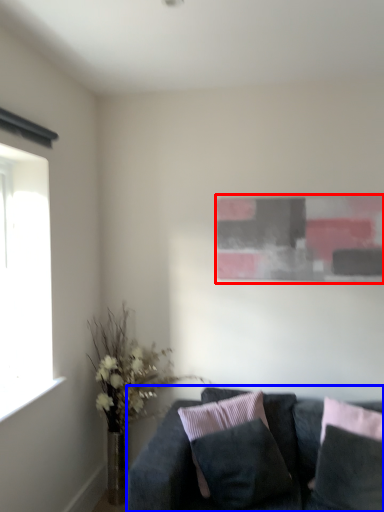
Question: Among these objects, which one is farthest to the camera, picture frame (highlighted by a red box) or studio couch (highlighted by a blue box)?

Choices:
 (A) picture frame
 (B) studio couch

Answer: (A)